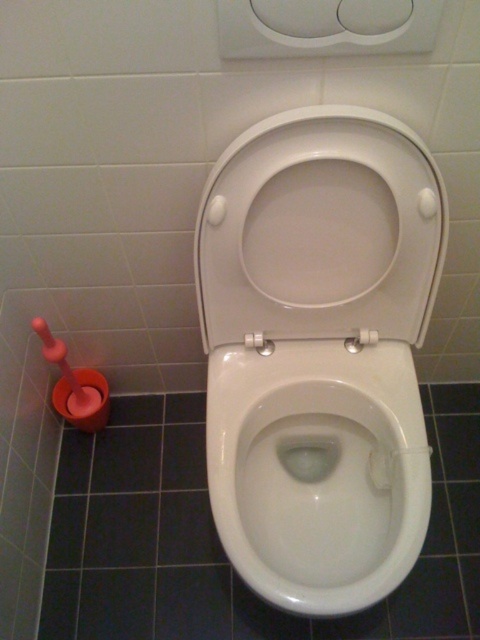
You are a bathroom designer planning to install a new red plunger and bucket set. The current white glossy toilet at center is at coordinates point 0.552, 0.665. If you want to place the new set to the left of the toilet, ensuring it is within the light gray tiled wall area, which is adjacent to the dark blue floor tiles, where should you position it?

The red plunger and bucket should be placed to the left of the white glossy toilet at center, near the light gray tiled wall. Since the toilet is at coordinates point (319, 353), positioning the set slightly to the left along the same y coordinate would place it within the light gray wall area adjacent to the dark blue floor tiles.